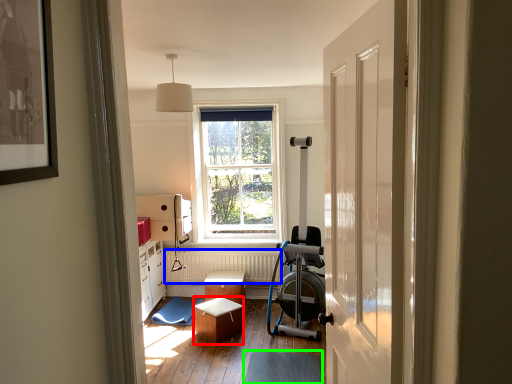
Question: Estimate the real-world distances between objects in this image. Which object is farther from stool (highlighted by a red box), radiator (highlighted by a blue box) or footrest (highlighted by a green box)?

Choices:
 (A) radiator
 (B) footrest

Answer: (A)